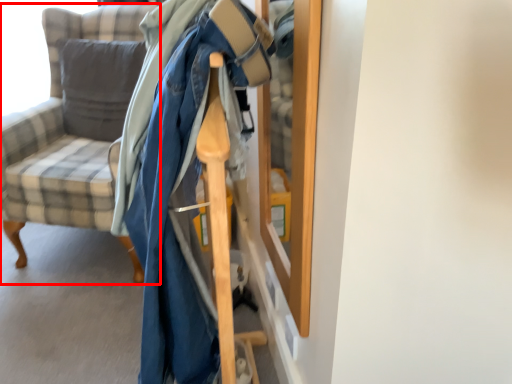
Question: Considering the relative positions of chair (annotated by the red box) and pillow in the image provided, where is chair (annotated by the red box) located with respect to the staircase?

Choices:
 (A) right
 (B) left

Answer: (A)